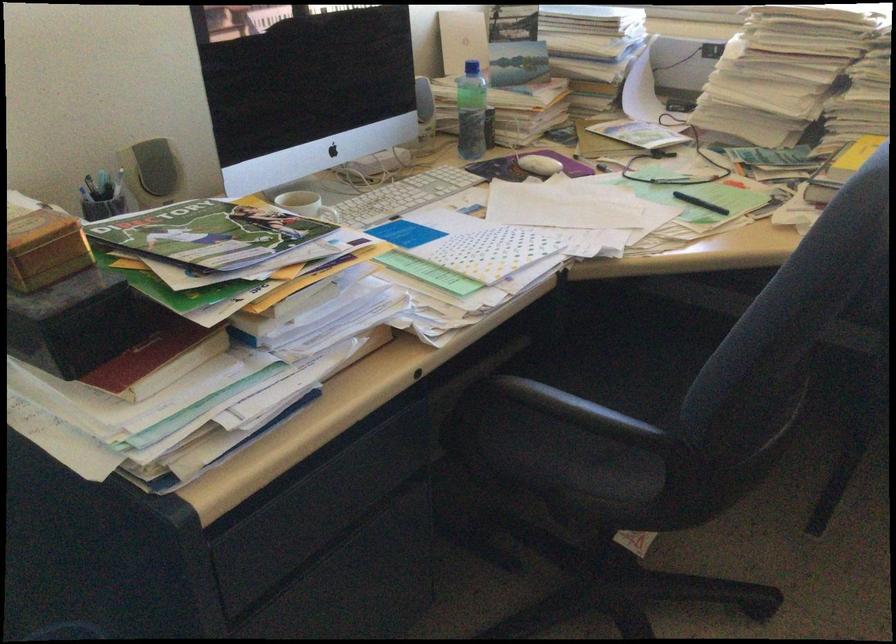
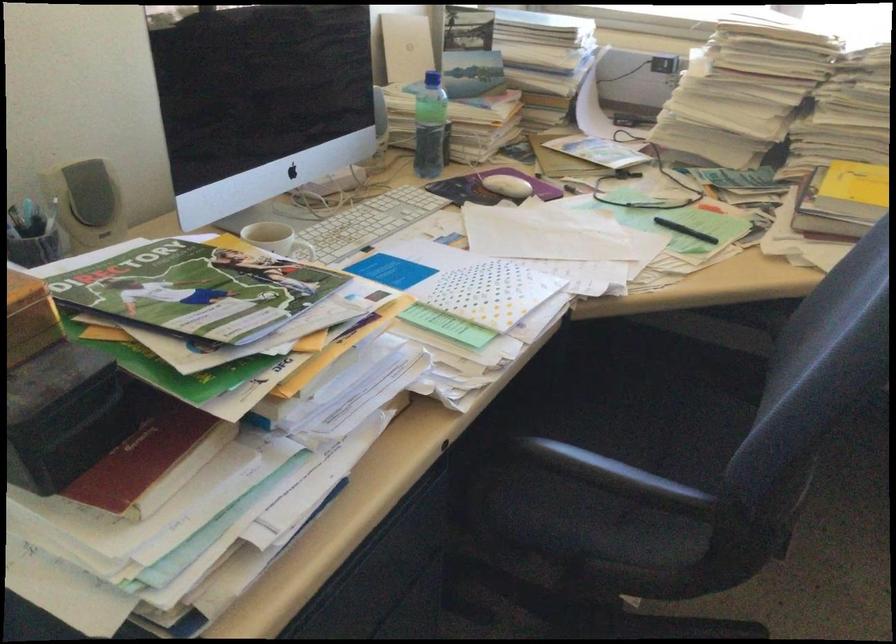
In the second image, find the point that corresponds to [204,239] in the first image.

(195, 290)